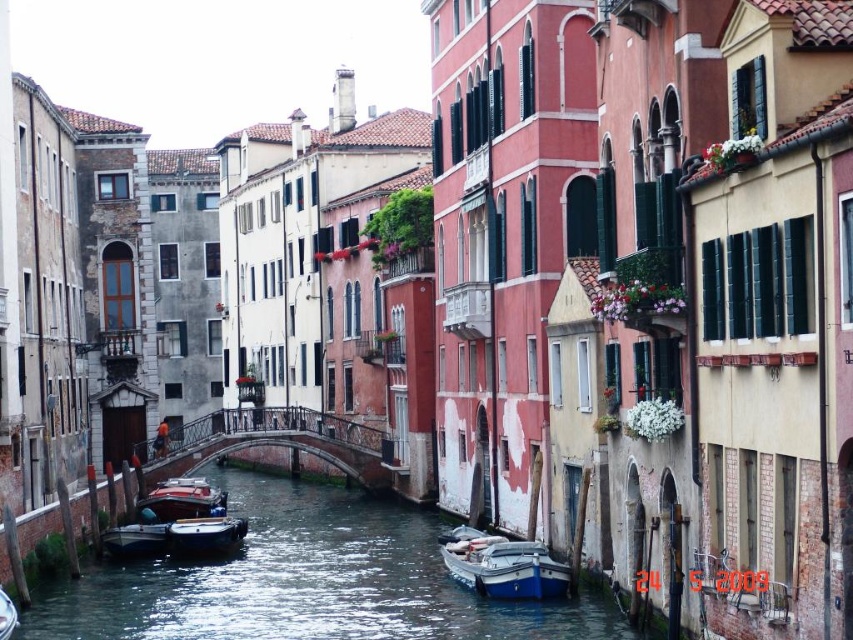
Consider the image. Does white glossy boat at lower center appear over shiny red boat at center?

Incorrect, white glossy boat at lower center is not positioned above shiny red boat at center.

Between white glossy boat at lower center and shiny red boat at center, which one is positioned lower?

white glossy boat at lower center is lower down.

What do you see at coordinates (502, 564) in the screenshot?
I see `white glossy boat at lower center` at bounding box center [502, 564].

In order to click on white glossy boat at lower center in this screenshot , I will do `click(502, 564)`.

Which of these two, shiny red boat at center or matte black boat at center, stands taller?

Standing taller between the two is matte black boat at center.

Is shiny red boat at center to the left of matte black boat at center from the viewer's perspective?

Incorrect, shiny red boat at center is not on the left side of matte black boat at center.

Between point (183, 508) and point (143, 520), which one is positioned behind?

The point (183, 508) is more distant.

Find the location of a particular element. shiny red boat at center is located at coordinates (181, 500).

Between metallic bridge at center and matte black boat at center, which one has less height?

matte black boat at center

The image size is (853, 640). What are the coordinates of `metallic bridge at center` in the screenshot? It's located at (273, 442).

The height and width of the screenshot is (640, 853). I want to click on metallic bridge at center, so click(273, 442).